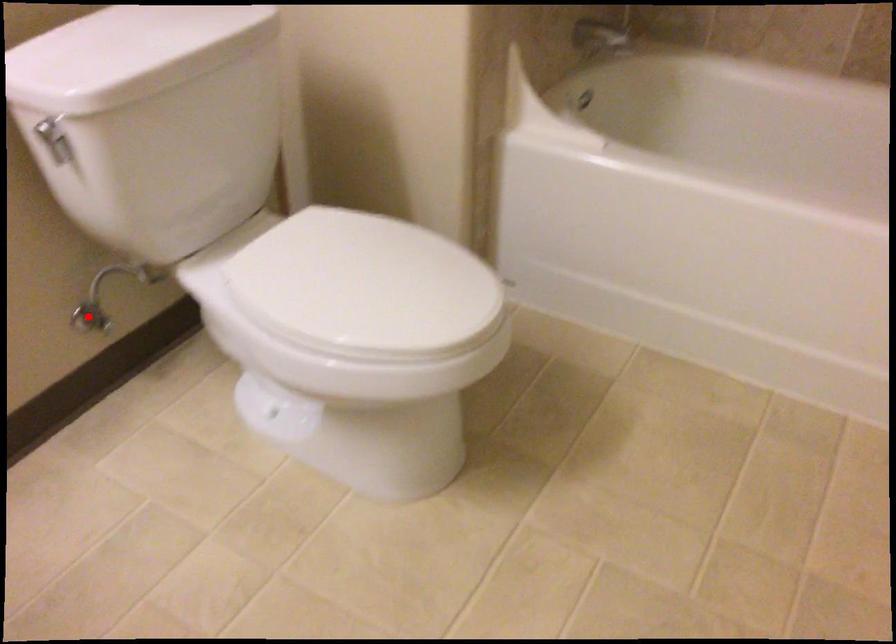
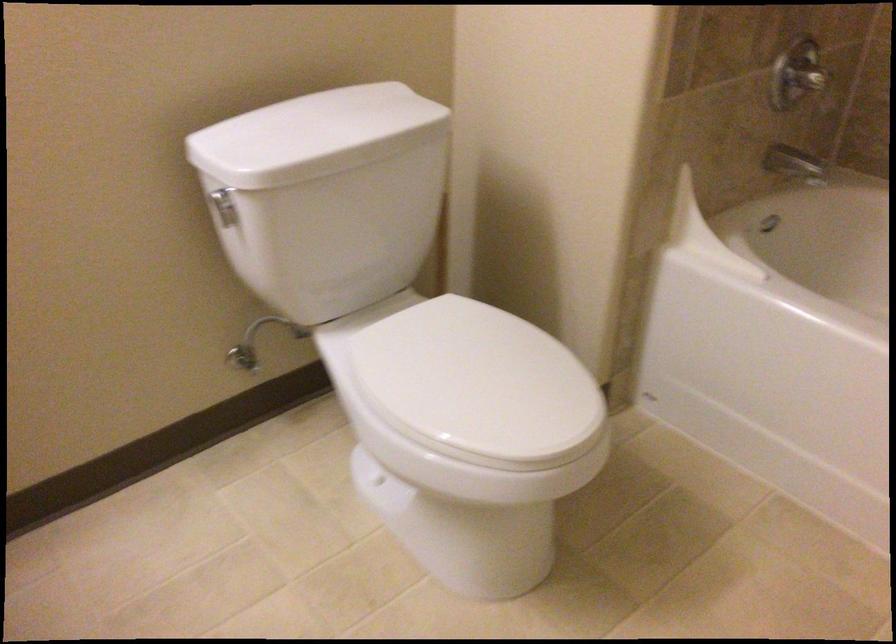
Question: A red point is marked in image1. In image2, is the corresponding 3D point closer to the camera or farther? Reply with the corresponding letter.

Choices:
 (A) The corresponding 3D point is closer.
 (B) The corresponding 3D point is farther.

Answer: (B)